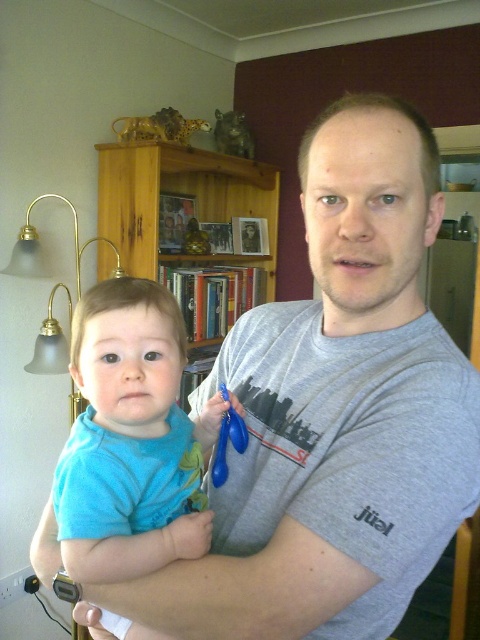
Does gray cotton t-shirt at center have a lesser height compared to wooden bookshelf at upper center?

Incorrect, gray cotton t-shirt at center's height does not fall short of wooden bookshelf at upper center's.

Does gray cotton t-shirt at center have a greater width compared to wooden bookshelf at upper center?

In fact, gray cotton t-shirt at center might be narrower than wooden bookshelf at upper center.

At what (x,y) coordinates should I click in order to perform the action: click on gray cotton t-shirt at center. Please return your answer as a coordinate pair (x, y). The width and height of the screenshot is (480, 640). Looking at the image, I should click on (348, 362).